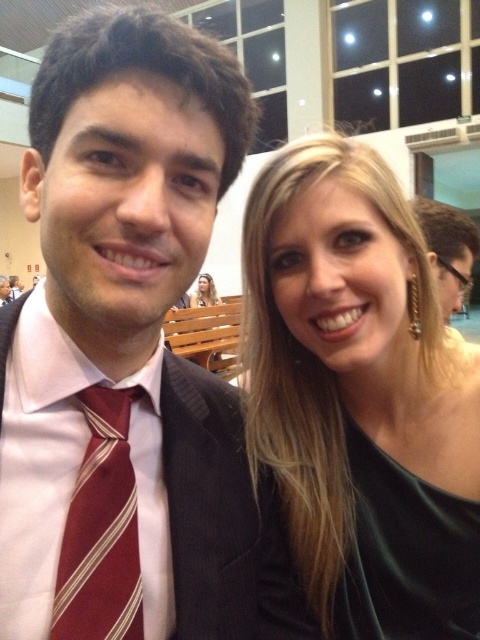
Consider the image. Which of these two, maroon striped tie at center or matte black hair at upper right, stands shorter?

Standing shorter between the two is maroon striped tie at center.

Between point (126, 605) and point (459, 246), which one is positioned behind?

The point (459, 246) is more distant.

Which is behind, point (134, 522) or point (467, 253)?

Point (467, 253)

Where is `maroon striped tie at center`? The image size is (480, 640). maroon striped tie at center is located at coordinates (100, 531).

What do you see at coordinates (108, 310) in the screenshot?
I see `matte black suit at left` at bounding box center [108, 310].

Is the position of matte black suit at left more distant than that of maroon striped tie at center?

No, it is not.

Between point (56, 211) and point (123, 568), which one is positioned behind?

Positioned behind is point (123, 568).

The image size is (480, 640). I want to click on matte black suit at left, so click(x=108, y=310).

Is maroon striped tie at center positioned at the back of matte black hair at upper center?

No, it is in front of matte black hair at upper center.

Can you confirm if maroon striped tie at center is positioned below matte black hair at upper center?

Indeed, maroon striped tie at center is positioned under matte black hair at upper center.

What do you see at coordinates (100, 531) in the screenshot?
I see `maroon striped tie at center` at bounding box center [100, 531].

Locate an element on the screen. This screenshot has height=640, width=480. maroon striped tie at center is located at coordinates (100, 531).